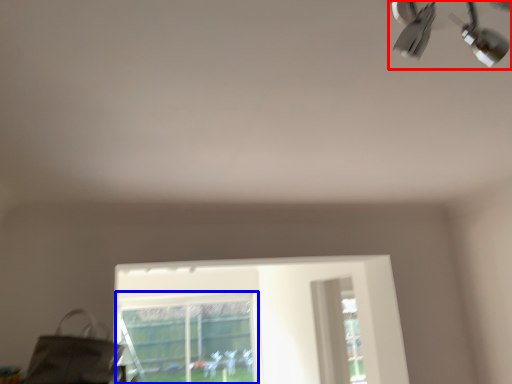
Question: Which point is further to the camera, lamp (highlighted by a red box) or bay window (highlighted by a blue box)?

Choices:
 (A) lamp
 (B) bay window

Answer: (B)